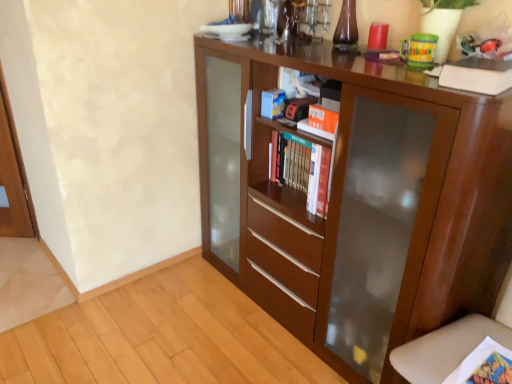
Question: Is point (438, 77) closer or farther from the camera than point (245, 172)?

Choices:
 (A) farther
 (B) closer

Answer: (B)

Question: Would you say white matte book at upper right is to the left or to the right of brown wood cupboard at center in the picture?

Choices:
 (A) left
 (B) right

Answer: (B)

Question: Considering the real-world distances, which object is closest to the white matte book at upper right?

Choices:
 (A) brown wood cupboard at center
 (B) hardcover books at center

Answer: (B)

Question: Which is farther from the brown wood cupboard at center?

Choices:
 (A) hardcover books at center
 (B) white matte book at upper right

Answer: (B)